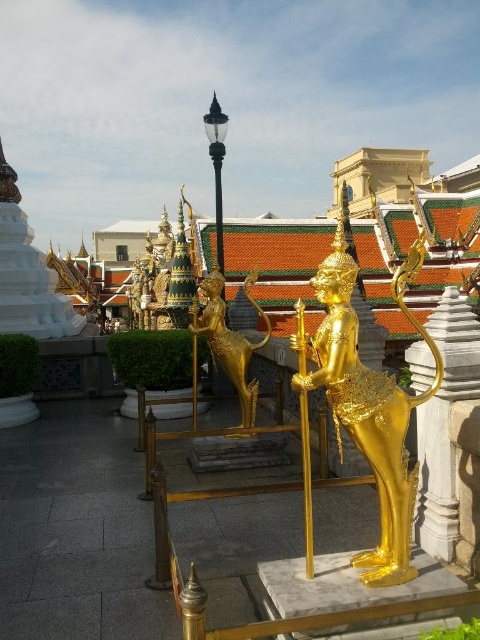
You are an architect visiting this temple complex and need to determine the relative heights of the structures. Based on the scene, which object is taller between the white stone pillar at right and the gold metallic statue at center?

The gold metallic statue at center is taller than the white stone pillar at right.